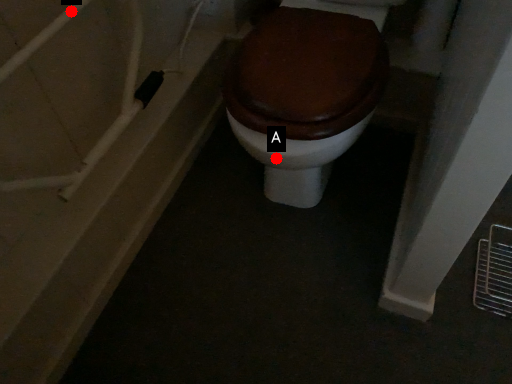
Question: Two points are circled on the image, labeled by A and B beside each circle. Which point is closer to the camera taking this photo?

Choices:
 (A) A is closer
 (B) B is closer

Answer: (B)